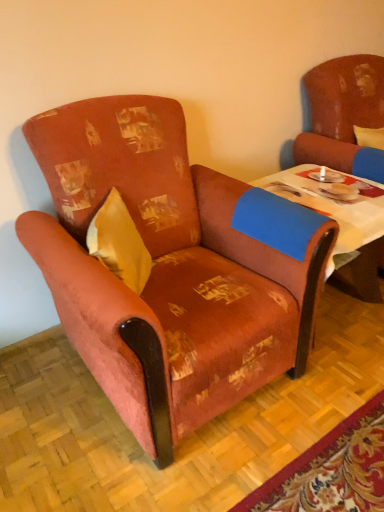
The width and height of the screenshot is (384, 512). In order to click on yellow fabric pillow at left in this screenshot , I will do `click(119, 243)`.

Identify the location of textured orange armchair at left, the second chair from the right. The height and width of the screenshot is (512, 384). (171, 267).

Locate an element on the screen. The height and width of the screenshot is (512, 384). blue fabric table at center is located at coordinates (341, 224).

Considering the sizes of objects blue fabric table at center and yellow fabric pillow at left in the image provided, who is taller, blue fabric table at center or yellow fabric pillow at left?

With more height is yellow fabric pillow at left.

I want to click on pillow on the left of blue fabric table at center, so click(119, 243).

Is blue fabric table at center turned away from yellow fabric pillow at left?

blue fabric table at center does not have its back to yellow fabric pillow at left.

How different are the orientations of blue fabric table at center and yellow fabric pillow at left in degrees?

blue fabric table at center and yellow fabric pillow at left are facing 51.5 degrees away from each other.

In terms of width, does yellow fabric pillow at left look wider or thinner when compared to distressed brown armchair at right, placed as the first chair when sorted from right to left?

yellow fabric pillow at left is thinner than distressed brown armchair at right, placed as the first chair when sorted from right to left.

Is yellow fabric pillow at left bigger than distressed brown armchair at right, the 2th chair viewed from the left?

No, yellow fabric pillow at left is not bigger than distressed brown armchair at right, the 2th chair viewed from the left.

Which is nearer, [147,261] or [325,85]?

The point [147,261] is in front.

From the image's perspective, which is above, yellow fabric pillow at left or distressed brown armchair at right, the 2th chair viewed from the left?

distressed brown armchair at right, the 2th chair viewed from the left.

Locate an element on the screen. The height and width of the screenshot is (512, 384). pillow located on the left of distressed brown armchair at right, placed as the first chair when sorted from right to left is located at coordinates (119, 243).

Is distressed brown armchair at right, the 2th chair viewed from the left, not close to yellow fabric pillow at left?

distressed brown armchair at right, the 2th chair viewed from the left, is far away from yellow fabric pillow at left.

Which object is more forward, distressed brown armchair at right, placed as the first chair when sorted from right to left, or yellow fabric pillow at left?

yellow fabric pillow at left is more forward.

Does distressed brown armchair at right, the 2th chair viewed from the left, have a greater width compared to yellow fabric pillow at left?

Yes, distressed brown armchair at right, the 2th chair viewed from the left, is wider than yellow fabric pillow at left.

Considering the relative sizes of textured orange armchair at left, the second chair from the right, and blue fabric table at center in the image provided, is textured orange armchair at left, the second chair from the right, smaller than blue fabric table at center?

Actually, textured orange armchair at left, the second chair from the right, might be larger than blue fabric table at center.

Consider the image. From the image's perspective, is textured orange armchair at left, which is the first chair from left to right, over blue fabric table at center?

Actually, textured orange armchair at left, which is the first chair from left to right, appears below blue fabric table at center in the image.

Is textured orange armchair at left, the second chair from the right, directly adjacent to blue fabric table at center?

Answer: No, textured orange armchair at left, the second chair from the right, is not in contact with blue fabric table at center.

Based on their sizes in the image, would you say textured orange armchair at left, which is the first chair from left to right, is bigger or smaller than distressed brown armchair at right, the 2th chair viewed from the left?

Considering their sizes, textured orange armchair at left, which is the first chair from left to right, takes up more space than distressed brown armchair at right, the 2th chair viewed from the left.

Looking at this image, is textured orange armchair at left, the second chair from the right, turned away from distressed brown armchair at right, the 2th chair viewed from the left?

textured orange armchair at left, the second chair from the right, does not have its back to distressed brown armchair at right, the 2th chair viewed from the left.

Between point (246, 361) and point (368, 161), which one is positioned behind?

The point (368, 161) is more distant.

At what (x,y) coordinates should I click in order to perform the action: click on table on the left of distressed brown armchair at right, placed as the first chair when sorted from right to left. Please return your answer as a coordinate pair (x, y). This screenshot has width=384, height=512. Looking at the image, I should click on (341, 224).

Would you say blue fabric table at center is part of distressed brown armchair at right, placed as the first chair when sorted from right to left,'s contents?

No, blue fabric table at center is not inside distressed brown armchair at right, placed as the first chair when sorted from right to left.

Is distressed brown armchair at right, the 2th chair viewed from the left, far from blue fabric table at center?

No, there isn't a large distance between distressed brown armchair at right, the 2th chair viewed from the left, and blue fabric table at center.

Is distressed brown armchair at right, placed as the first chair when sorted from right to left, smaller than blue fabric table at center?

Actually, distressed brown armchair at right, placed as the first chair when sorted from right to left, might be larger than blue fabric table at center.

From the image's perspective, is textured orange armchair at left, the second chair from the right, beneath yellow fabric pillow at left?

No.

Where is `chair in front of the yellow fabric pillow at left`? The width and height of the screenshot is (384, 512). chair in front of the yellow fabric pillow at left is located at coordinates (171, 267).

In the scene shown: Looking at the image, does textured orange armchair at left, the second chair from the right, seem bigger or smaller compared to yellow fabric pillow at left?

textured orange armchair at left, the second chair from the right, is bigger than yellow fabric pillow at left.

Consider the image. Is textured orange armchair at left, which is the first chair from left to right, positioned far away from yellow fabric pillow at left?

No, there isn't a large distance between textured orange armchair at left, which is the first chair from left to right, and yellow fabric pillow at left.

Locate an element on the screen. This screenshot has width=384, height=512. pillow below the blue fabric table at center (from the image's perspective) is located at coordinates (119, 243).

The height and width of the screenshot is (512, 384). Find the location of `pillow above the distressed brown armchair at right, the 2th chair viewed from the left (from a real-world perspective)`. pillow above the distressed brown armchair at right, the 2th chair viewed from the left (from a real-world perspective) is located at coordinates (119, 243).

Which object lies nearer to the anchor point blue fabric table at center, textured orange armchair at left, which is the first chair from left to right, or distressed brown armchair at right, placed as the first chair when sorted from right to left?

Among the two, distressed brown armchair at right, placed as the first chair when sorted from right to left, is located nearer to blue fabric table at center.

Estimate the real-world distances between objects in this image. Which object is closer to textured orange armchair at left, the second chair from the right, yellow fabric pillow at left or blue fabric table at center?

The object closer to textured orange armchair at left, the second chair from the right, is yellow fabric pillow at left.

Estimate the real-world distances between objects in this image. Which object is further from distressed brown armchair at right, the 2th chair viewed from the left, textured orange armchair at left, the second chair from the right, or yellow fabric pillow at left?

Among the two, yellow fabric pillow at left is located further to distressed brown armchair at right, the 2th chair viewed from the left.

Based on their spatial positions, is distressed brown armchair at right, placed as the first chair when sorted from right to left, or textured orange armchair at left, which is the first chair from left to right, further from blue fabric table at center?

textured orange armchair at left, which is the first chair from left to right, is further to blue fabric table at center.

When comparing their distances from blue fabric table at center, does yellow fabric pillow at left or textured orange armchair at left, which is the first chair from left to right, seem closer?

textured orange armchair at left, which is the first chair from left to right, is positioned closer to the anchor blue fabric table at center.

From the image, which object appears to be nearer to textured orange armchair at left, which is the first chair from left to right, distressed brown armchair at right, placed as the first chair when sorted from right to left, or yellow fabric pillow at left?

yellow fabric pillow at left lies closer to textured orange armchair at left, which is the first chair from left to right, than the other object.

Based on their spatial positions, is yellow fabric pillow at left or blue fabric table at center closer to distressed brown armchair at right, the 2th chair viewed from the left?

blue fabric table at center lies closer to distressed brown armchair at right, the 2th chair viewed from the left, than the other object.

Based on their spatial positions, is textured orange armchair at left, which is the first chair from left to right, or blue fabric table at center further from yellow fabric pillow at left?

blue fabric table at center lies further to yellow fabric pillow at left than the other object.

Identify the location of table situated between yellow fabric pillow at left and distressed brown armchair at right, placed as the first chair when sorted from right to left, from left to right. (341, 224).

Identify the location of table located between textured orange armchair at left, which is the first chair from left to right, and distressed brown armchair at right, placed as the first chair when sorted from right to left, in the left-right direction. (341, 224).

Locate an element on the screen. The width and height of the screenshot is (384, 512). chair located between yellow fabric pillow at left and blue fabric table at center in the left-right direction is located at coordinates (171, 267).

Locate an element on the screen. chair between yellow fabric pillow at left and distressed brown armchair at right, the 2th chair viewed from the left, from left to right is located at coordinates (171, 267).